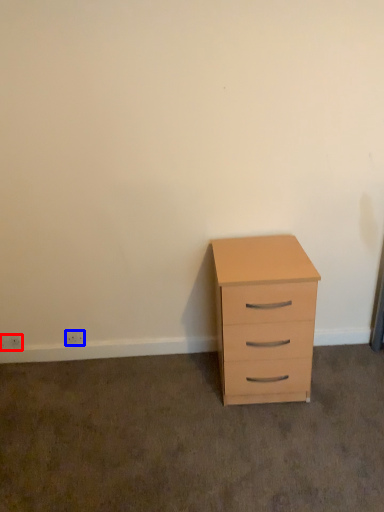
Question: Among these objects, which one is nearest to the camera, electric outlet (highlighted by a red box) or electric outlet (highlighted by a blue box)?

Choices:
 (A) electric outlet
 (B) electric outlet

Answer: (B)